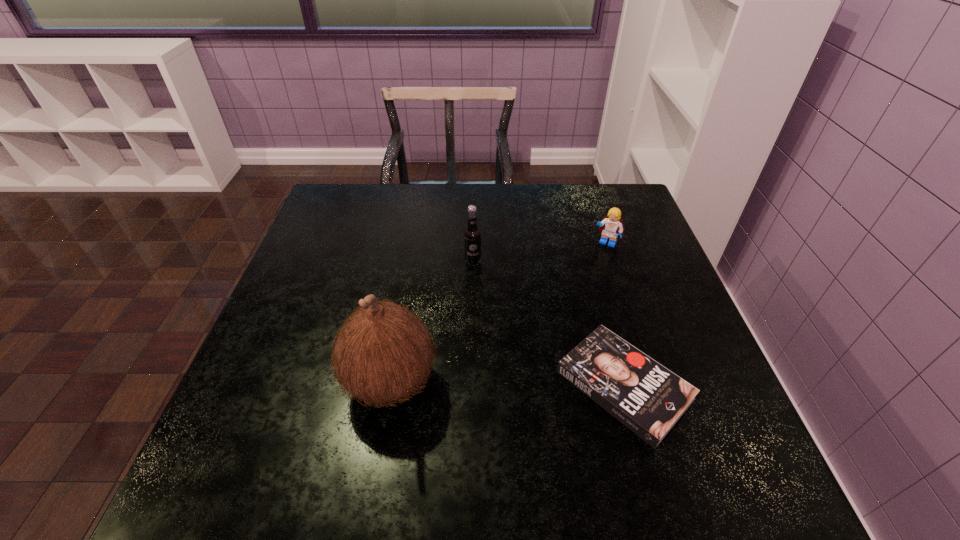
This screenshot has width=960, height=540. I want to click on vacant spot on the desktop that is between the coconut and the shortest object and is positioned on the label of the third object from right to left, so click(511, 383).

Find the location of `vacant space on the desktop that is between the leftmost object and the shortest object and is positioned on the front-facing side of the farthest object`. vacant space on the desktop that is between the leftmost object and the shortest object and is positioned on the front-facing side of the farthest object is located at coordinates (523, 383).